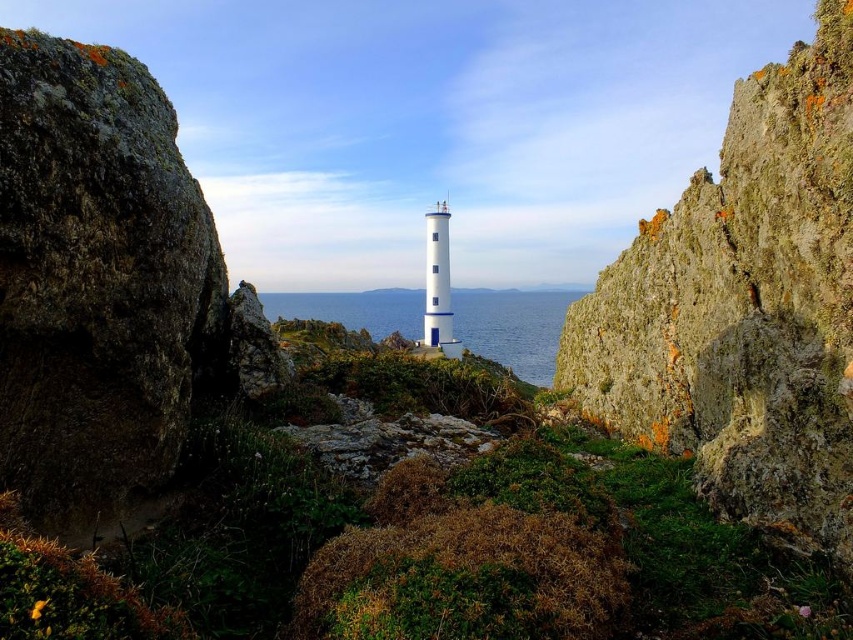
You are a hiker who wants to take a photo of the blue water at center from the rusty rock cliff at center right. Based on the scene, will the cliff block your view of the water?

The rusty rock cliff at center right is not as tall as blue water at center, so the cliff will not block your view of the water.

You are standing at the camera position and want to reach the point at coordinates point (703, 381). If your walking speed is 1.5 meters per second, how many seconds will it take to reach there?

The distance of point (703, 381) from camera is 19.67 meters. At a speed of 1.5 meters per second, it would take approximately 13.11 seconds to reach there.

You are a hiker who wants to reach the lighthouse. You see a rusty rock cliff at center right marked by point (744, 307). Is the lighthouse located to the left or right of this point?

The lighthouse is located to the left of the rusty rock cliff at center right marked by point (744, 307) because the lighthouse is described as being on a rocky outcrop in the scene, and the point marks the cliff at center right, implying the lighthouse is positioned to its left.